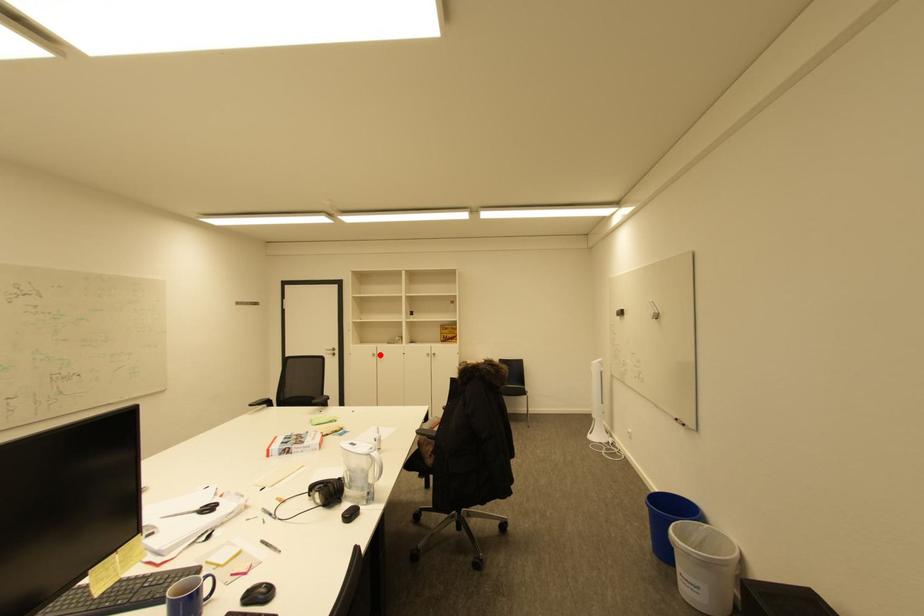
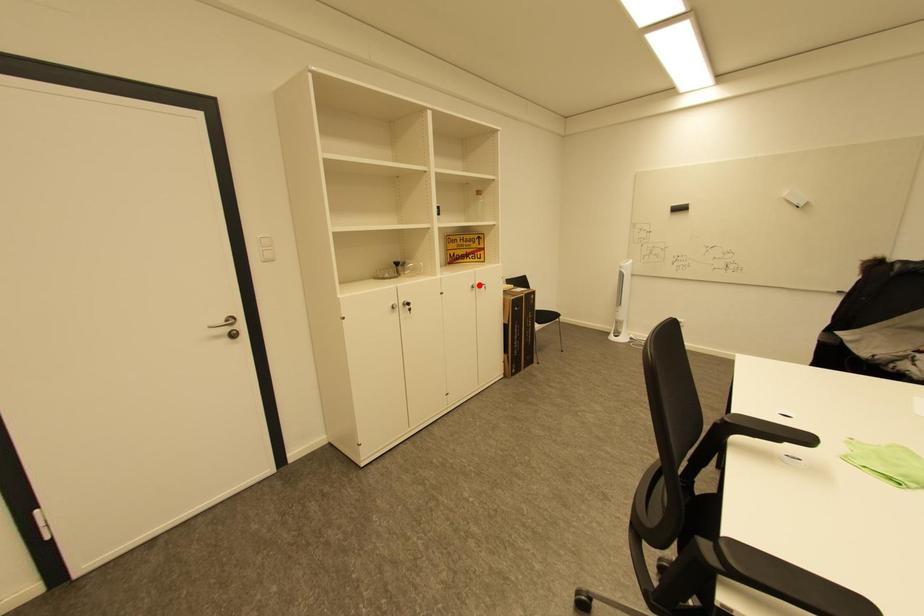
I am providing you with two images of the same scene from different viewpoints. A red point is marked on the first image and another point is marked on the second image. Is the red point in image1 aligned with the point shown in image2?

No